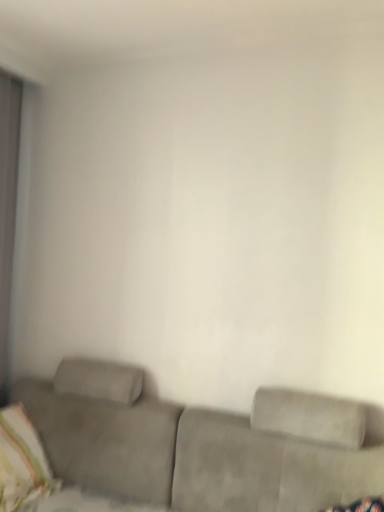
The width and height of the screenshot is (384, 512). I want to click on striped fabric pillow at lower left, so click(x=22, y=463).

Describe the element at coordinates (22, 463) in the screenshot. The width and height of the screenshot is (384, 512). I see `striped fabric pillow at lower left` at that location.

What do you see at coordinates (198, 444) in the screenshot? The height and width of the screenshot is (512, 384). I see `suede couch at lower center` at bounding box center [198, 444].

Locate an element on the screen. This screenshot has width=384, height=512. suede couch at lower center is located at coordinates (198, 444).

Measure the distance between suede couch at lower center and camera.

suede couch at lower center and camera are 5.52 feet apart.

You are a GUI agent. You are given a task and a screenshot of the screen. Output one action in this format:
    pyautogui.click(x=<x>, y=<y>)
    Task: Click on the striped fabric pillow at lower left
    The width and height of the screenshot is (384, 512).
    Given the screenshot: What is the action you would take?
    pyautogui.click(x=22, y=463)

Between suede couch at lower center and striped fabric pillow at lower left, which one appears on the right side from the viewer's perspective?

From the viewer's perspective, suede couch at lower center appears more on the right side.

Is suede couch at lower center closer to camera compared to striped fabric pillow at lower left?

Yes, suede couch at lower center is closer to the viewer.

Is point (226, 470) in front of point (6, 497)?

Yes, it is.

From the image's perspective, is suede couch at lower center on striped fabric pillow at lower left?

Incorrect, from the image's perspective, suede couch at lower center is lower than striped fabric pillow at lower left.

From the picture: From a real-world perspective, does suede couch at lower center sit lower than striped fabric pillow at lower left?

Yes.

Is suede couch at lower center wider or thinner than striped fabric pillow at lower left?

In the image, suede couch at lower center appears to be wider than striped fabric pillow at lower left.

Considering the relative sizes of suede couch at lower center and striped fabric pillow at lower left in the image provided, is suede couch at lower center shorter than striped fabric pillow at lower left?

No, suede couch at lower center is not shorter than striped fabric pillow at lower left.

Does suede couch at lower center have a smaller size compared to striped fabric pillow at lower left?

Actually, suede couch at lower center might be larger than striped fabric pillow at lower left.

Is suede couch at lower center surrounding striped fabric pillow at lower left?

Yes, striped fabric pillow at lower left can be found within suede couch at lower center.

In the scene shown: Are suede couch at lower center and striped fabric pillow at lower left located far from each other?

That's not correct — suede couch at lower center is a little close to striped fabric pillow at lower left.

Consider the image. Is suede couch at lower center facing away from striped fabric pillow at lower left?

Yes.

How different are the orientations of suede couch at lower center and striped fabric pillow at lower left in degrees?

76.1 degrees.

Identify the location of studio couch on the right of striped fabric pillow at lower left. Image resolution: width=384 pixels, height=512 pixels. (198, 444).

Between striped fabric pillow at lower left and suede couch at lower center, which one appears on the left side from the viewer's perspective?

From the viewer's perspective, striped fabric pillow at lower left appears more on the left side.

Which object is further away from the camera taking this photo, striped fabric pillow at lower left or suede couch at lower center?

striped fabric pillow at lower left is further from the camera.

Considering the points (21, 411) and (125, 389), which point is behind, point (21, 411) or point (125, 389)?

The point (21, 411) is farther from the camera.

From the image's perspective, between striped fabric pillow at lower left and suede couch at lower center, which one is located above?

striped fabric pillow at lower left.

From a real-world perspective, is striped fabric pillow at lower left physically above suede couch at lower center?

Indeed, from a real-world perspective, striped fabric pillow at lower left stands above suede couch at lower center.

Which object is wider, striped fabric pillow at lower left or suede couch at lower center?

With larger width is suede couch at lower center.

Considering the relative sizes of striped fabric pillow at lower left and suede couch at lower center in the image provided, is striped fabric pillow at lower left taller than suede couch at lower center?

No, striped fabric pillow at lower left is not taller than suede couch at lower center.

Can you confirm if striped fabric pillow at lower left is bigger than suede couch at lower center?

No, striped fabric pillow at lower left is not bigger than suede couch at lower center.

Is striped fabric pillow at lower left not inside suede couch at lower center?

No.

Is striped fabric pillow at lower left not close to suede couch at lower center?

No, striped fabric pillow at lower left is not far from suede couch at lower center.

Is striped fabric pillow at lower left aimed at suede couch at lower center?

Yes, striped fabric pillow at lower left is turned towards suede couch at lower center.

Measure the distance between striped fabric pillow at lower left and suede couch at lower center.

The distance of striped fabric pillow at lower left from suede couch at lower center is 37.24 centimeters.

At what (x,y) coordinates should I click in order to perform the action: click on pillow that is above the suede couch at lower center (from a real-world perspective). Please return your answer as a coordinate pair (x, y). Looking at the image, I should click on (22, 463).

Image resolution: width=384 pixels, height=512 pixels. I want to click on studio couch that appears in front of the striped fabric pillow at lower left, so click(x=198, y=444).

This screenshot has height=512, width=384. I want to click on studio couch below the striped fabric pillow at lower left (from the image's perspective), so [198, 444].